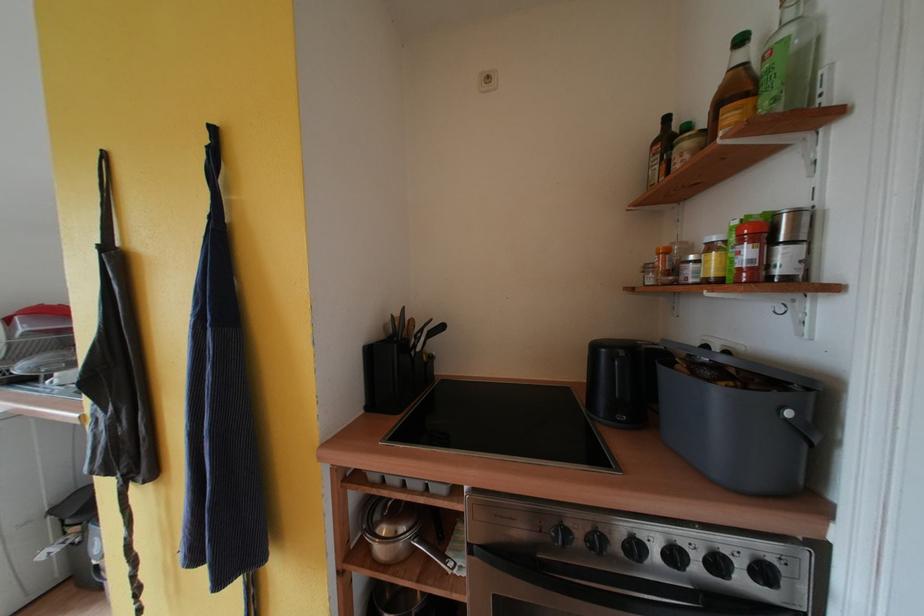
Find the location of a particular element. The image size is (924, 616). grey bin lid is located at coordinates (505, 424).